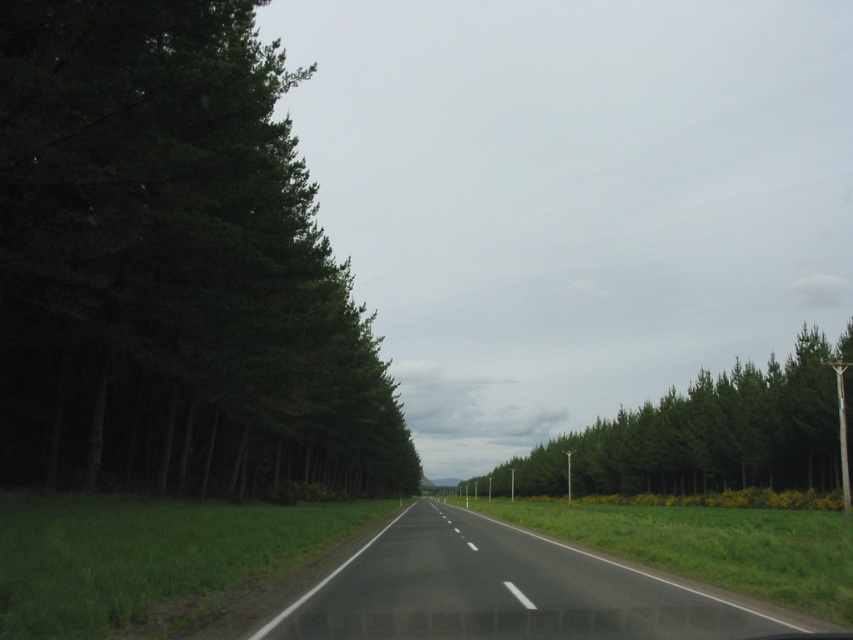
Question: In this image, where is black asphalt road at center located relative to green leafy trees at center?

Choices:
 (A) above
 (B) below

Answer: (B)

Question: Which of these objects is positioned farthest from the dark green textured trees at left?

Choices:
 (A) black asphalt road at center
 (B) green leafy trees at center

Answer: (B)

Question: Does dark green textured trees at left come in front of black asphalt road at center?

Choices:
 (A) no
 (B) yes

Answer: (A)

Question: Does dark green textured trees at left have a greater width compared to green leafy trees at center?

Choices:
 (A) yes
 (B) no

Answer: (B)

Question: Which point appears farthest from the camera in this image?

Choices:
 (A) coord(299,596)
 (B) coord(730,419)
 (C) coord(12,452)

Answer: (B)

Question: Which of the following is the farthest from the observer?

Choices:
 (A) (26, 365)
 (B) (515, 545)
 (C) (670, 419)

Answer: (C)